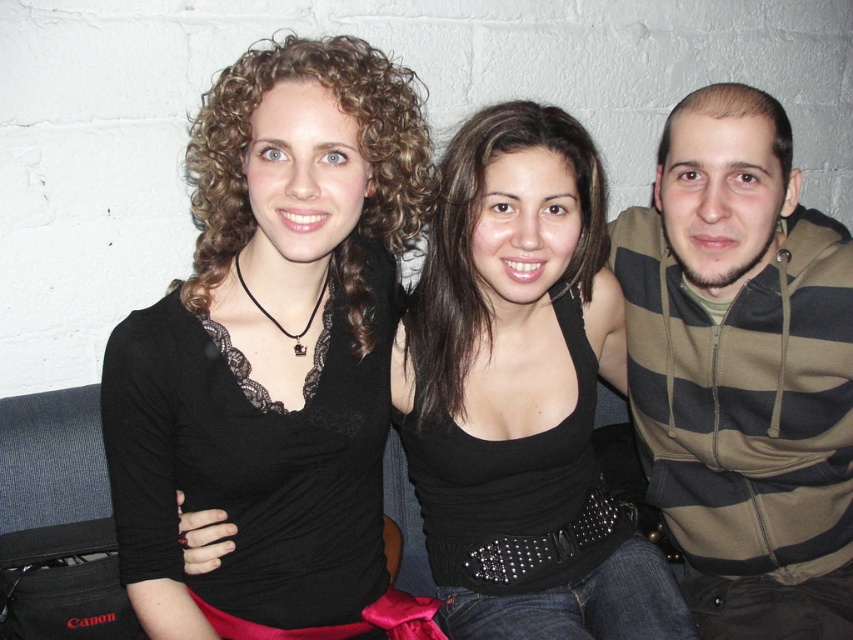
Can you confirm if black leather tank top at center is positioned to the left of striped hoodie at right?

Indeed, black leather tank top at center is positioned on the left side of striped hoodie at right.

Is black leather tank top at center positioned behind striped hoodie at right?

No, it is not.

Measure the distance between point (x=509, y=330) and camera.

Point (x=509, y=330) and camera are 4.13 feet apart.

Locate an element on the screen. The image size is (853, 640). black leather tank top at center is located at coordinates (521, 394).

Does point (347, 540) come behind point (672, 308)?

No, (347, 540) is in front of (672, 308).

Is black lace top at center to the left of striped hoodie at right from the viewer's perspective?

Indeed, black lace top at center is positioned on the left side of striped hoodie at right.

Which is in front, point (128, 436) or point (653, 381)?

Positioned in front is point (128, 436).

This screenshot has height=640, width=853. What are the coordinates of `black lace top at center` in the screenshot? It's located at (271, 346).

Is black lace top at center closer to camera compared to black leather tank top at center?

Yes, black lace top at center is closer to the viewer.

Is point (164, 598) farther from camera compared to point (621, 337)?

No, it is not.

Where is `black lace top at center`? black lace top at center is located at coordinates (271, 346).

Identify the location of black lace top at center. The height and width of the screenshot is (640, 853). (271, 346).